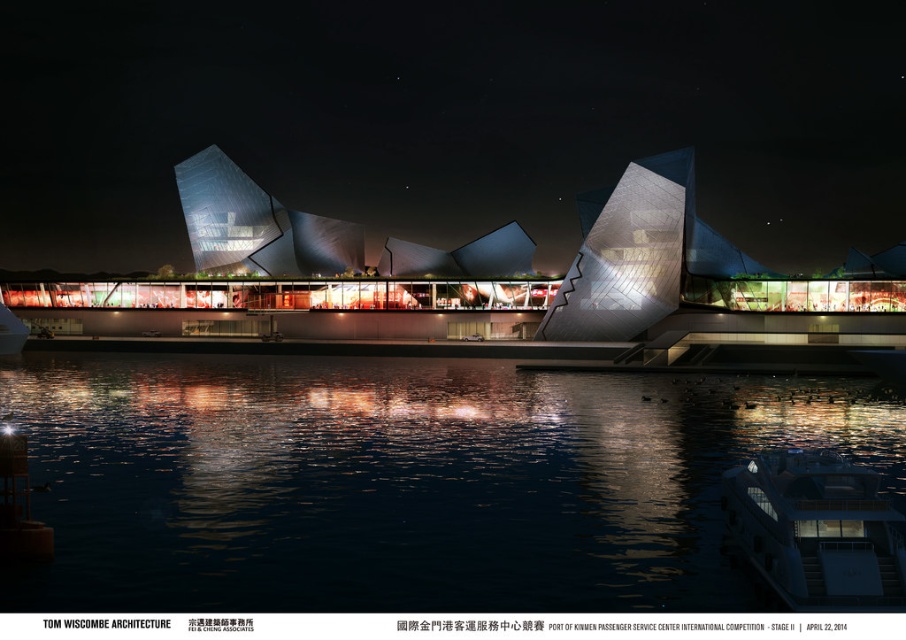
Question: Estimate the real-world distances between objects in this image. Which object is closer to the dark reflective water at center?

Choices:
 (A) sleek glass building at center
 (B) white glossy yacht at lower right

Answer: (B)

Question: Can you confirm if sleek glass building at center is thinner than dark reflective water at center?

Choices:
 (A) yes
 (B) no

Answer: (B)

Question: Is the position of dark reflective water at center less distant than that of white glossy yacht at lower right?

Choices:
 (A) no
 (B) yes

Answer: (B)

Question: Is sleek glass building at center positioned behind white glossy yacht at lower right?

Choices:
 (A) no
 (B) yes

Answer: (B)

Question: Among these points, which one is farthest from the camera?

Choices:
 (A) (196, 483)
 (B) (864, 540)

Answer: (A)

Question: Which point is farther to the camera?

Choices:
 (A) (553, 476)
 (B) (724, 481)

Answer: (A)